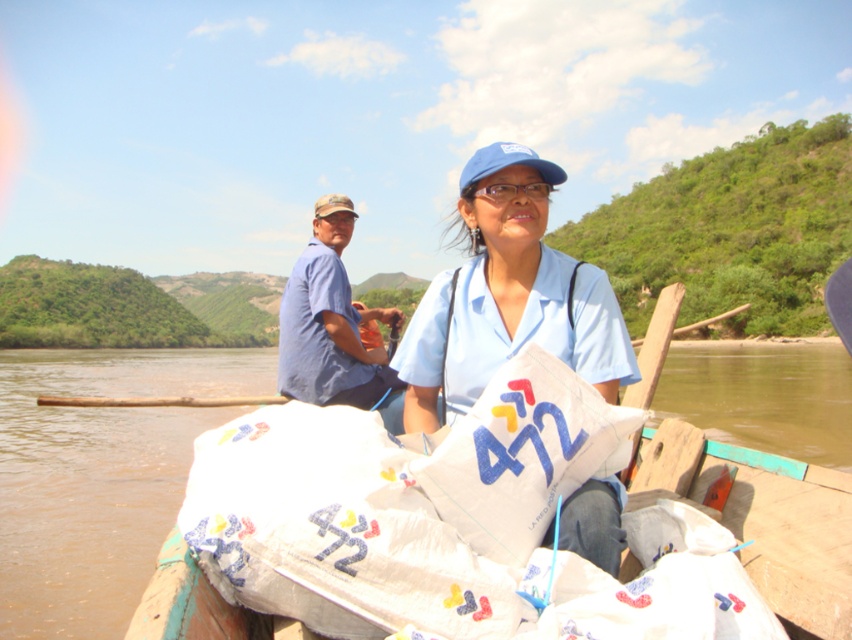
You are a traveler observing the scene and want to know which item is shorter between the white fabric bags at center and the blue cotton shirt at center. Can you tell me?

The white fabric bags at center is shorter than the blue cotton shirt at center according to the description.

You are a photographer trying to capture the scene of the two people in the boat. You notice the white fabric bags at center and the blue cotton shirt at center. Which object would appear more detailed in a closeup photo if both are in focus?

The white fabric bags at center is thinner than blue cotton shirt at center, so the white fabric bags at center would appear more detailed in a closeup photo since thinner objects can show finer details when magnified.

You are a photographer trying to capture a photo of both the blue fabric shirt at center and the blue cotton shirt at center. Since you want them to be in the same frame, which shirt should you position closer to the center of the camera lens?

The blue fabric shirt at center is positioned on the right side of blue cotton shirt at center, so to include both in the same frame, position the blue cotton shirt at center closer to the center of the camera lens so that the blue fabric shirt at center can be on its right side.